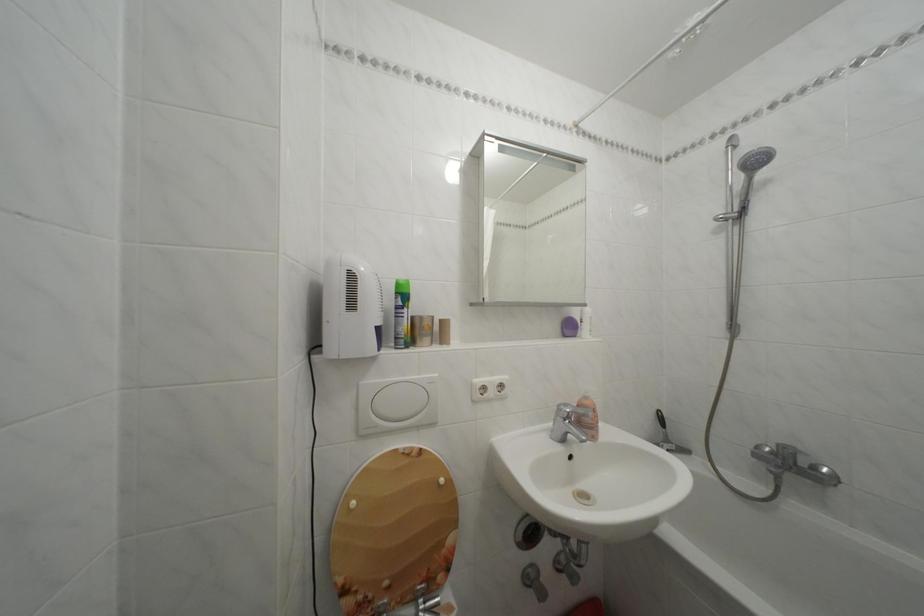
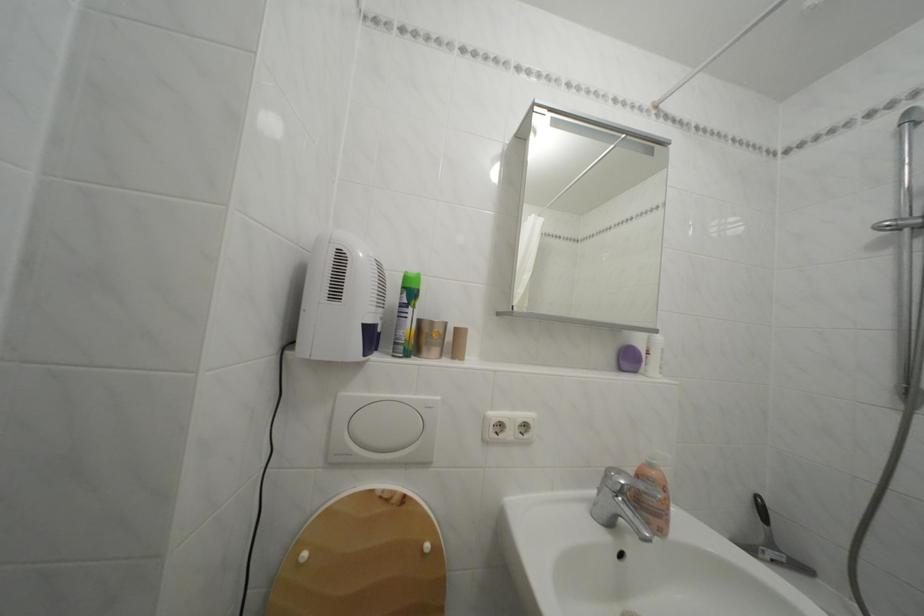
Question: The images are taken continuously from a first-person perspective. In which direction are you moving?

Choices:
 (A) Left
 (B) Right
 (C) Forward
 (D) Backward

Answer: (C)